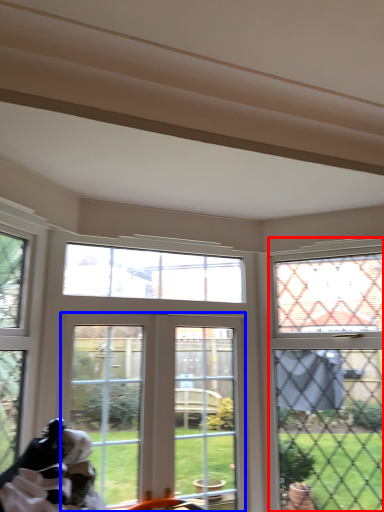
Question: Which point is further to the camera, window (highlighted by a red box) or window (highlighted by a blue box)?

Choices:
 (A) window
 (B) window

Answer: (B)